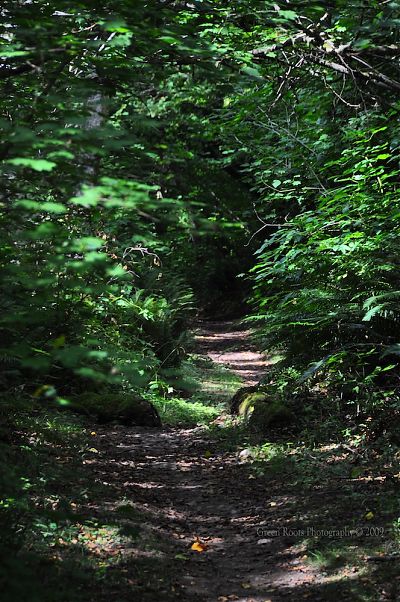
Locate an element on the screen. shade is located at coordinates (353, 510), (241, 483), (112, 448).